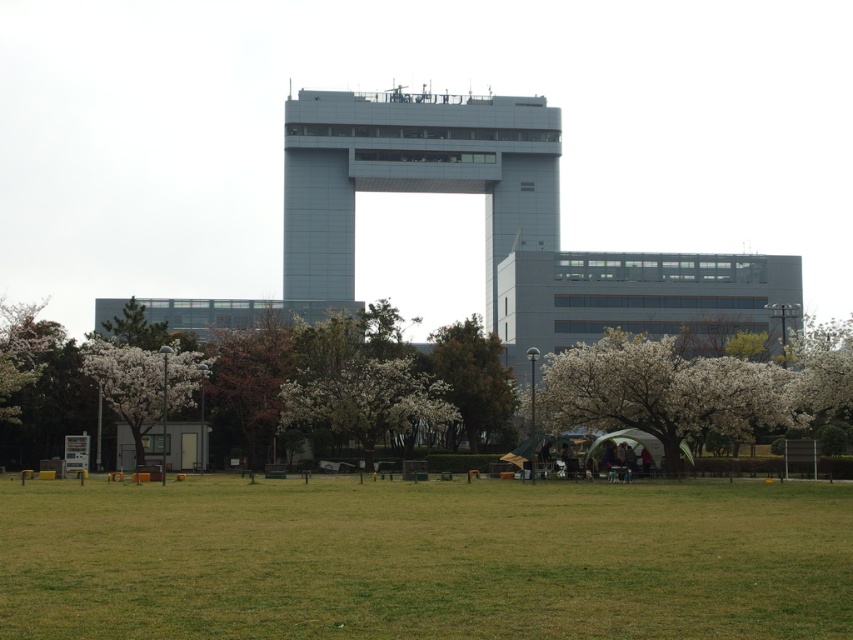
You are a drone operator planning to fly a drone from your current position to the sleek metallic tower at center. The drone has a maximum flight range of 150 meters. Can you safely reach the tower without exceeding the drone range?

The distance between the sleek metallic tower at center and the camera is 145.21 meters, which is within the drone maximum flight range of 150 meters. Yes, you can safely reach the tower without exceeding the drone range.

You are planning to install a new bench in the park between the brown textured tree at center and the white blossoming tree at right. The bench requires a minimum of 100 feet of space between the two trees to be placed safely. Based on the distance provided, is this installation feasible?

The brown textured tree at center is 116.90 feet from the white blossoming tree at right. Since the required minimum space is 100 feet, the installation is feasible as the distance exceeds the required minimum.